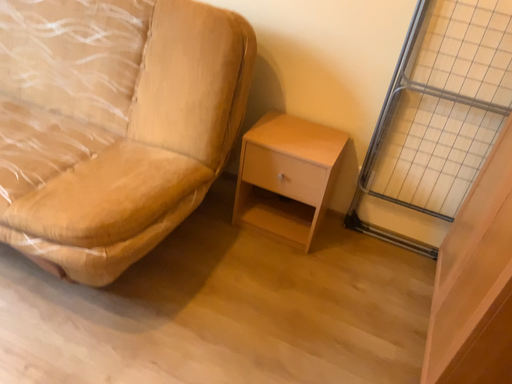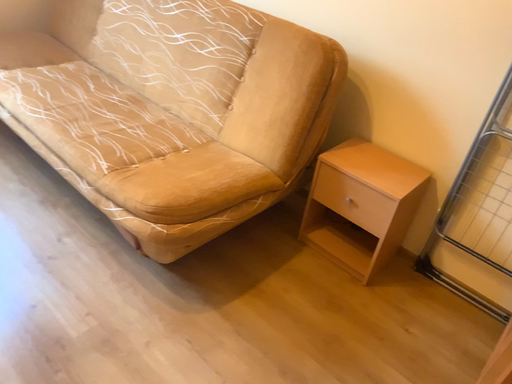
Question: Which way did the camera rotate in the video?

Choices:
 (A) rotated left
 (B) rotated right

Answer: (A)